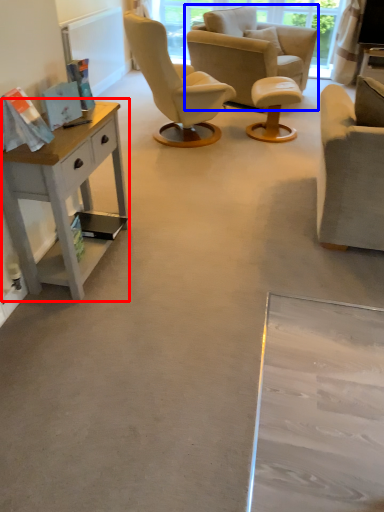
Question: Among these objects, which one is nearest to the camera, desk (highlighted by a red box) or chair (highlighted by a blue box)?

Choices:
 (A) desk
 (B) chair

Answer: (A)